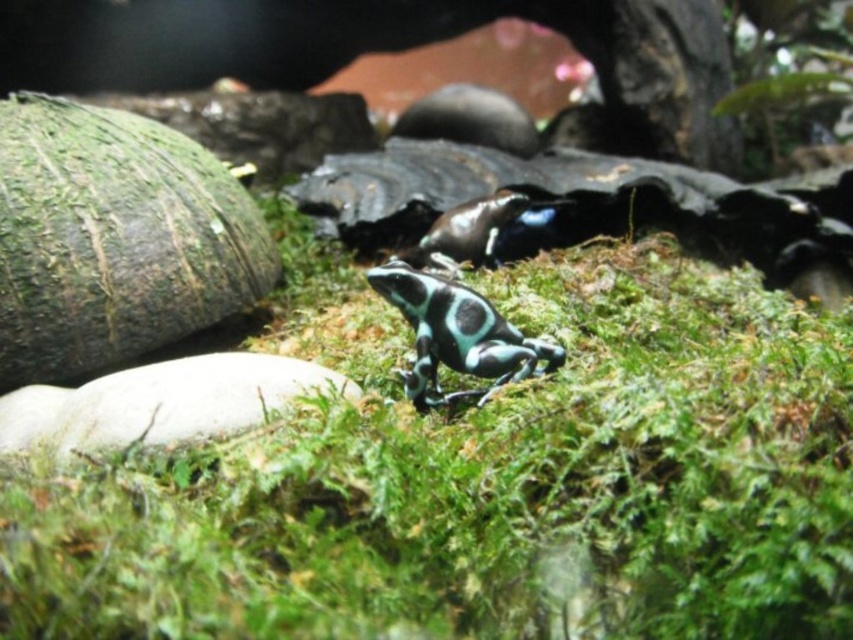
Question: Estimate the real-world distances between objects in this image. Which object is closer to the smooth green tortoise at center?

Choices:
 (A) green mossy grass at center
 (B) shiny black tortoise at center

Answer: (A)

Question: In this image, where is smooth green tortoise at center located relative to shiny black tortoise at center?

Choices:
 (A) left
 (B) right

Answer: (A)

Question: Is green mossy grass at center thinner than shiny black tortoise at center?

Choices:
 (A) no
 (B) yes

Answer: (A)

Question: Which point is closer to the camera taking this photo?

Choices:
 (A) (519, 333)
 (B) (488, 196)

Answer: (A)

Question: Does green mossy grass at center have a larger size compared to shiny black tortoise at center?

Choices:
 (A) no
 (B) yes

Answer: (B)

Question: Which of the following is the farthest from the observer?

Choices:
 (A) (413, 257)
 (B) (671, 509)
 (C) (471, 314)

Answer: (A)